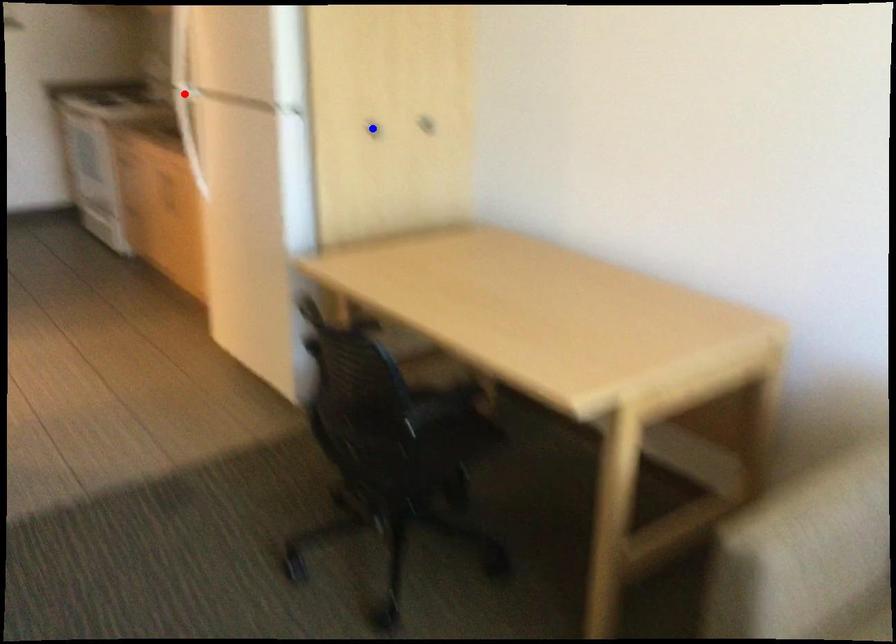
Question: In the image, two points are highlighted. Which point is nearer to the camera? Reply with the corresponding letter.

Choices:
 (A) blue point
 (B) red point

Answer: (A)